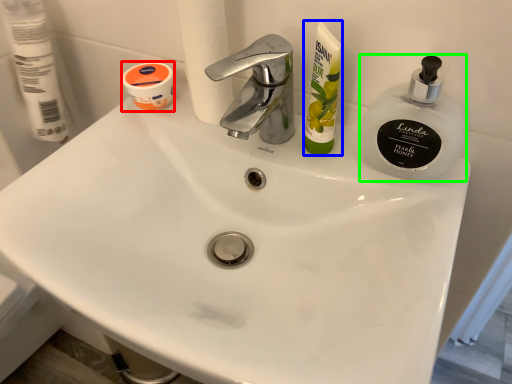
Question: Which is nearer to the mouthwash (highlighted by a red box)? toiletry (highlighted by a blue box) or soap dispenser (highlighted by a green box).

Choices:
 (A) toiletry
 (B) soap dispenser

Answer: (A)